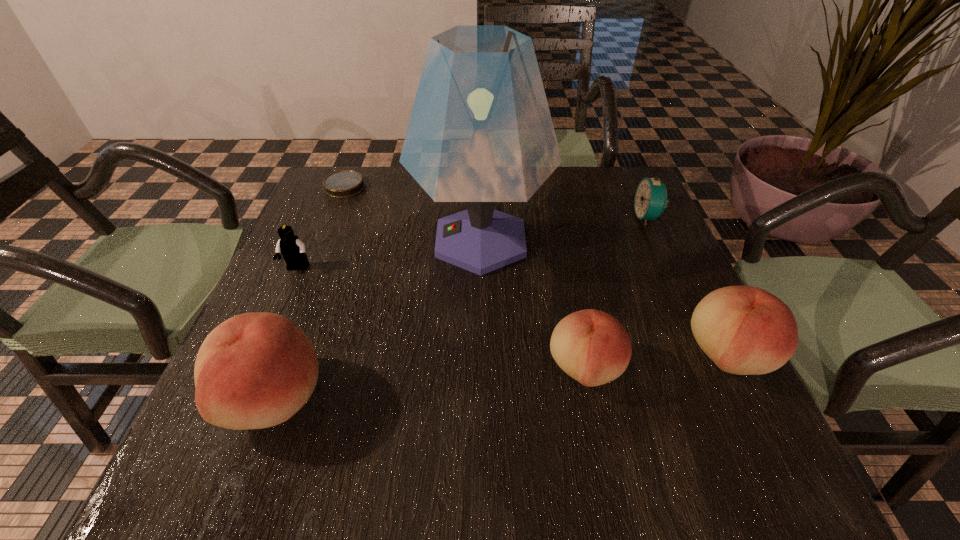
If we want them evenly spaced by inserting an extra peach among them, please locate a free spot for this new peach. Please provide its 2D coordinates. Your answer should be formatted as a tuple, i.e. [(x, y)], where the tuple contains the x and y coordinates of a point satisfying the conditions above.

[(434, 383)]